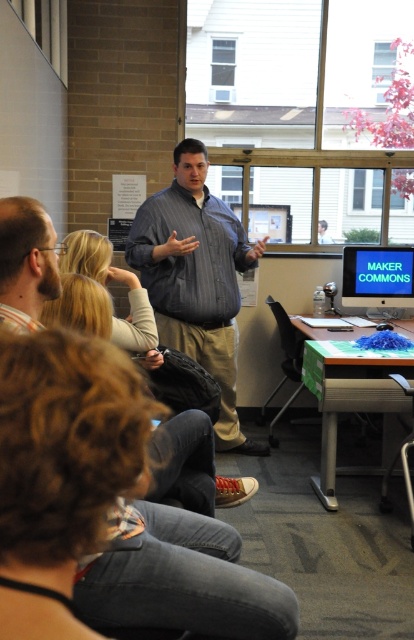
You are standing in the classroom and want to find the striped shirt at center. According to the scene description, where should you look relative to the large window behind the speaker?

The striped shirt at center is located at point (195, 278), which places it near the center of the image. Since the large window is behind the speaker, you should look towards the front of the room where the speaker is standing, facing away from the window.

You are standing at the back of the classroom and want to hand a note to the person wearing the beige fabric shirt at upper left. The striped shirt at center is blocking your path. Can you walk around them without getting too close? The minimum distance you need to maintain is 2 feet.

The striped shirt at center and beige fabric shirt at upper left are 6.62 feet apart. Since the minimum distance required is 2 feet, you can walk around the striped shirt at center while maintaining the necessary distance of 2 feet between yourself and the striped shirt at center.